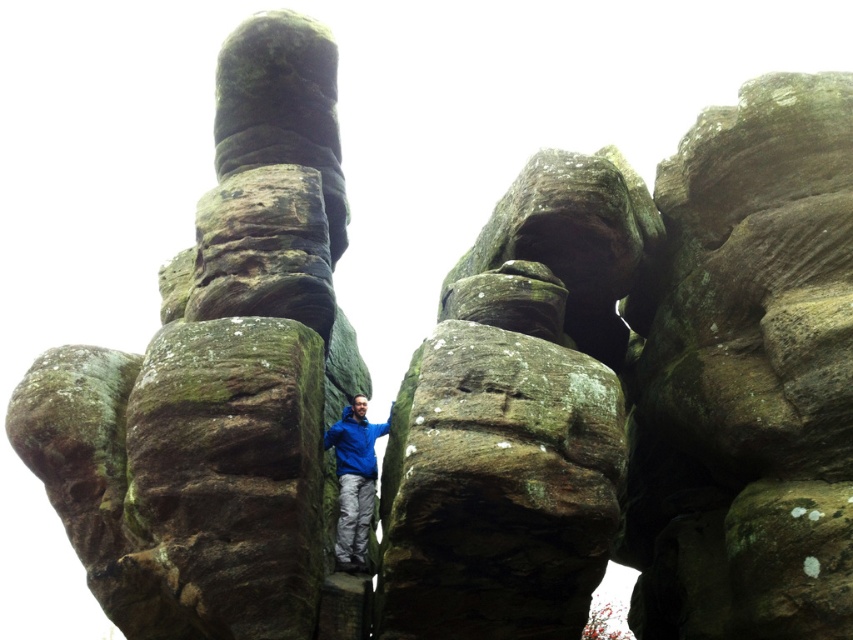
You are a hiker who wants to take a photo of the green mossy rock at center and the blue matte jacket at center. Which object is wider when viewed from your current position?

The green mossy rock at center is wider than the blue matte jacket at center.

Consider the image. You are a photographer planning to take a picture of the blue fabric jacket at center. The camera you are using has a focal length of 50mm. If you want to ensure the jacket is centered in the frame, where should you position the camera relative to the jacket?

The blue fabric jacket at center is located at point 0.753 on the x axis and 0.416 on the y axis. To center it in the frame, position the camera directly facing the jacket so that its coordinates align with the frame center.